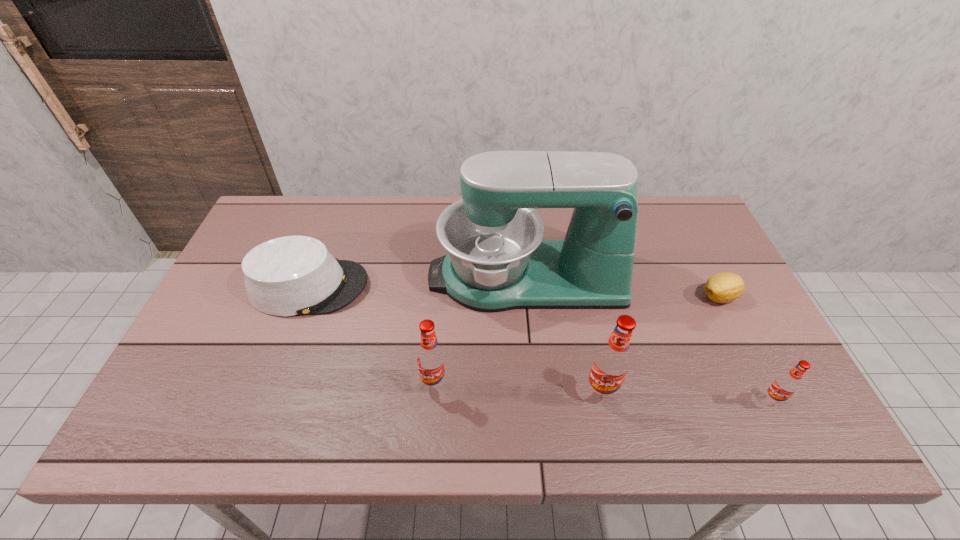
Find the location of a particular element. object that is at the left edge is located at coordinates (287, 276).

What are the coordinates of `root beer present at the right edge` in the screenshot? It's located at (786, 384).

At what (x,y) coordinates should I click in order to perform the action: click on lemon that is at the right edge. Please return your answer as a coordinate pair (x, y). This screenshot has height=540, width=960. Looking at the image, I should click on (725, 287).

You are a GUI agent. You are given a task and a screenshot of the screen. Output one action in this format:
    pyautogui.click(x=<x>, y=<y>)
    Task: Click on the object that is at the near right corner
    
    Given the screenshot: What is the action you would take?
    pyautogui.click(x=786, y=384)

At what (x,y) coordinates should I click in order to perform the action: click on vacant space at the far edge. Please return your answer as a coordinate pair (x, y). This screenshot has width=960, height=540. Looking at the image, I should click on (376, 220).

At what (x,y) coordinates should I click in order to perform the action: click on vacant region at the near edge of the desktop. Please return your answer as a coordinate pair (x, y). Image resolution: width=960 pixels, height=540 pixels. Looking at the image, I should click on click(264, 377).

At what (x,y) coordinates should I click in order to perform the action: click on blank area at the left edge. Please return your answer as a coordinate pair (x, y). Looking at the image, I should click on coord(235,292).

Where is `free region at the right edge of the desktop`? Image resolution: width=960 pixels, height=540 pixels. free region at the right edge of the desktop is located at coordinates (708, 331).

The width and height of the screenshot is (960, 540). In the image, there is a desktop. In order to click on vacant region at the far left corner in this screenshot , I will do pyautogui.click(x=268, y=212).

You are a GUI agent. You are given a task and a screenshot of the screen. Output one action in this format:
    pyautogui.click(x=<x>, y=<y>)
    Task: Click on the vacant area between the second shortest object and the fourth shortest object
    
    Given the screenshot: What is the action you would take?
    pyautogui.click(x=372, y=335)